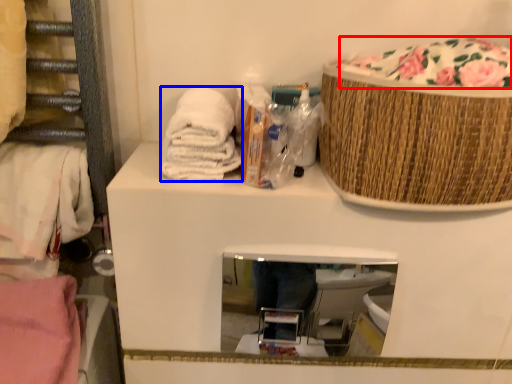
Question: Which of the following is the closest to the observer, food (highlighted by a red box) or material (highlighted by a blue box)?

Choices:
 (A) food
 (B) material

Answer: (A)